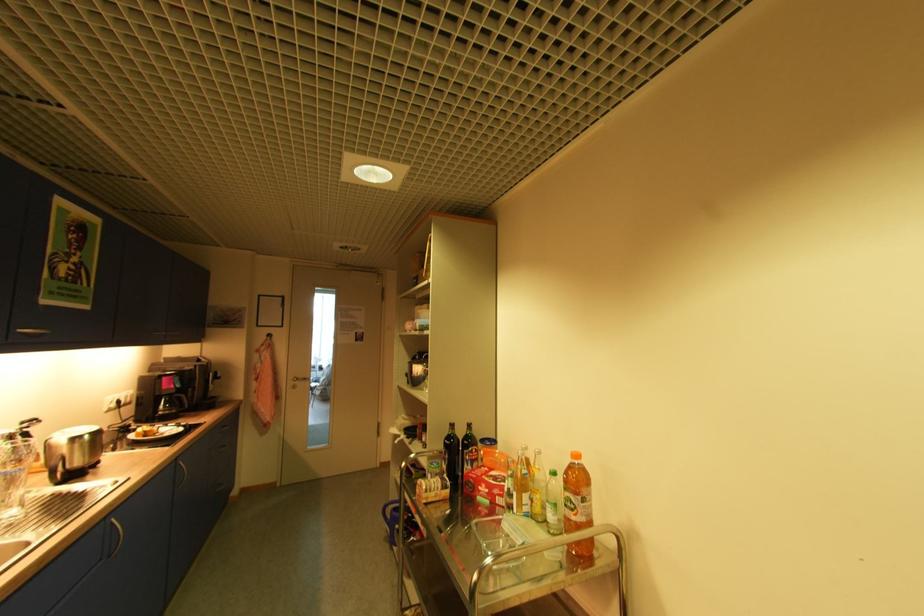
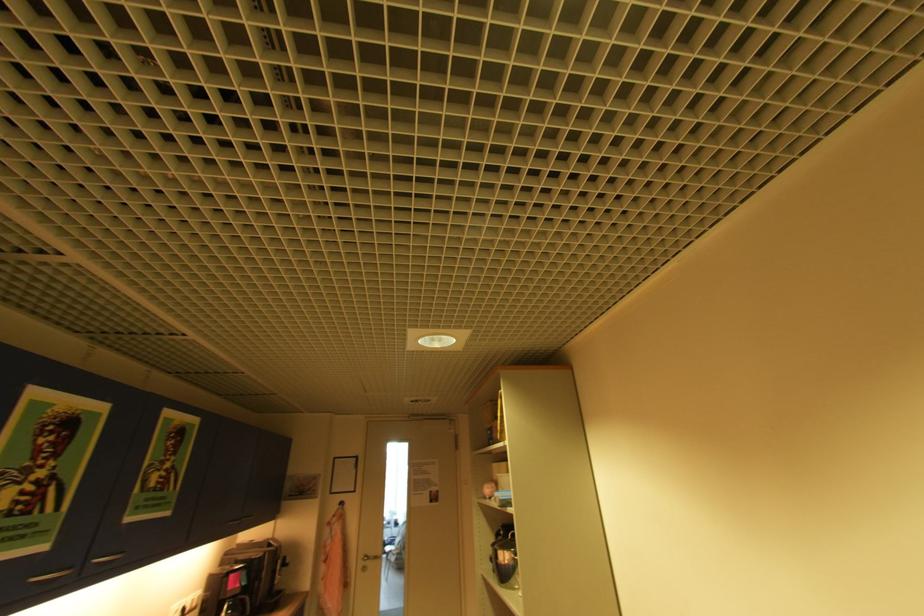
Question: In a continuous first-person perspective shot, in which direction is the camera moving?

Choices:
 (A) Left
 (B) Right
 (C) Forward
 (D) Backward

Answer: (C)